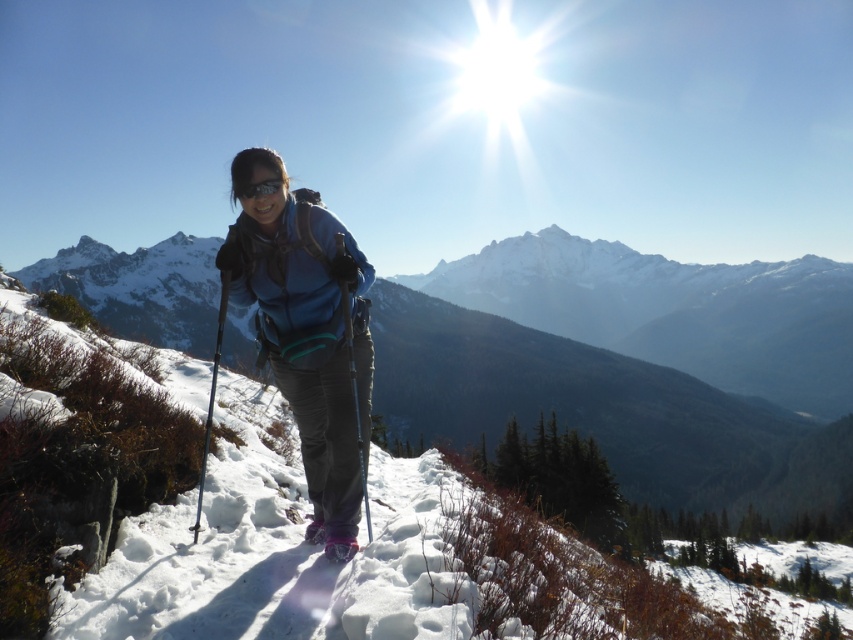
Between blue fabric jacket at center and matte black ski pole at center, which one has more height?

With more height is blue fabric jacket at center.

Can you confirm if blue fabric jacket at center is positioned to the left of matte black ski pole at center?

Indeed, blue fabric jacket at center is positioned on the left side of matte black ski pole at center.

Find the location of a particular element. blue fabric jacket at center is located at coordinates (308, 333).

At what (x,y) coordinates should I click in order to perform the action: click on blue fabric jacket at center. Please return your answer as a coordinate pair (x, y). This screenshot has height=640, width=853. Looking at the image, I should click on 308,333.

Find the location of a particular element. The width and height of the screenshot is (853, 640). blue fabric jacket at center is located at coordinates (308, 333).

Does blue fabric jacket at center appear under matte black goggles at center?

Correct, blue fabric jacket at center is located below matte black goggles at center.

Find the location of `blue fabric jacket at center`. blue fabric jacket at center is located at coordinates (308, 333).

Find the location of a particular element. blue fabric jacket at center is located at coordinates (308, 333).

Can you confirm if matte black ski pole at center is thinner than black metallic ski pole at center?

Yes.

From the picture: Can you confirm if matte black ski pole at center is wider than black metallic ski pole at center?

Incorrect, matte black ski pole at center's width does not surpass black metallic ski pole at center's.

Locate an element on the screen. The image size is (853, 640). matte black ski pole at center is located at coordinates (355, 397).

You are a GUI agent. You are given a task and a screenshot of the screen. Output one action in this format:
    pyautogui.click(x=<x>, y=<y>)
    Task: Click on the matte black ski pole at center
    The image size is (853, 640).
    Given the screenshot: What is the action you would take?
    pyautogui.click(x=355, y=397)